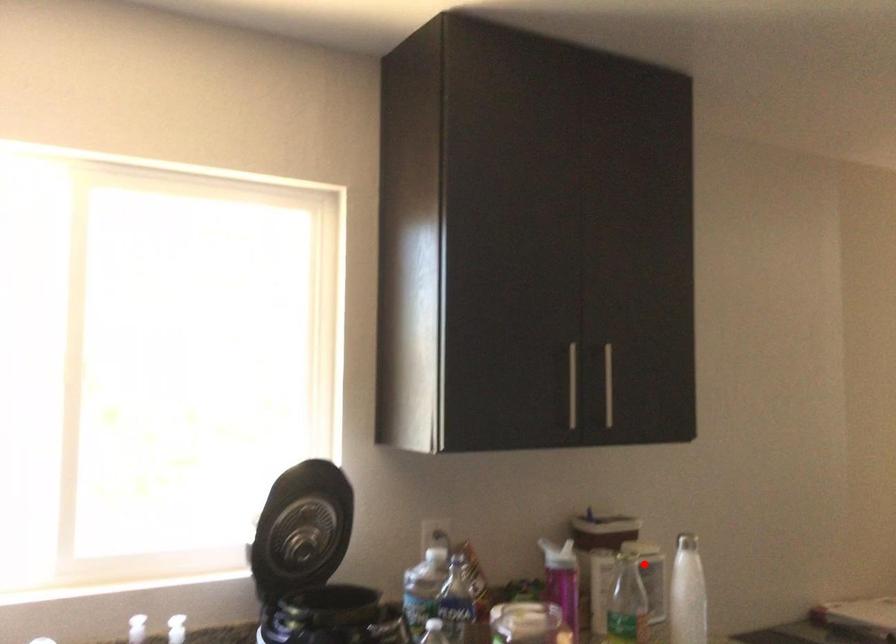
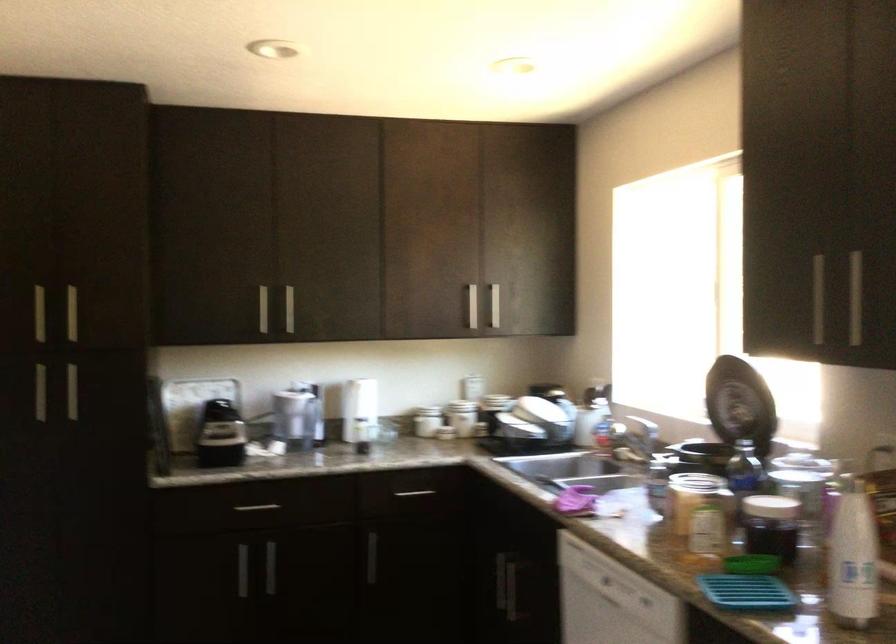
Question: I am providing you with two images of the same scene from different viewpoints. Image1 has a red point marked. In image2, the corresponding 3D location appears at what relative position? Reply with the corresponding letter.

Choices:
 (A) Closer
 (B) Farther

Answer: (A)